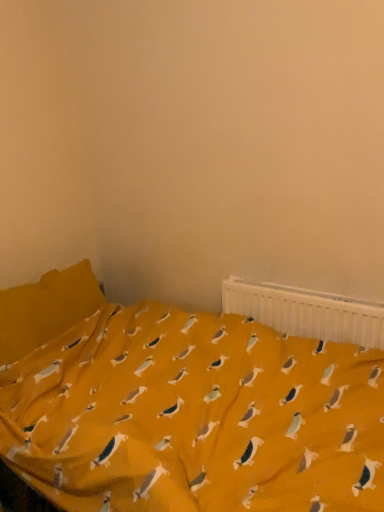
Find the location of `white plastic radiator at upper right`. white plastic radiator at upper right is located at coordinates (x=307, y=310).

The image size is (384, 512). Describe the element at coordinates (307, 310) in the screenshot. I see `white plastic radiator at upper right` at that location.

Measure the distance between white plastic radiator at upper right and camera.

The depth of white plastic radiator at upper right is 1.53 meters.

I want to click on white plastic radiator at upper right, so click(x=307, y=310).